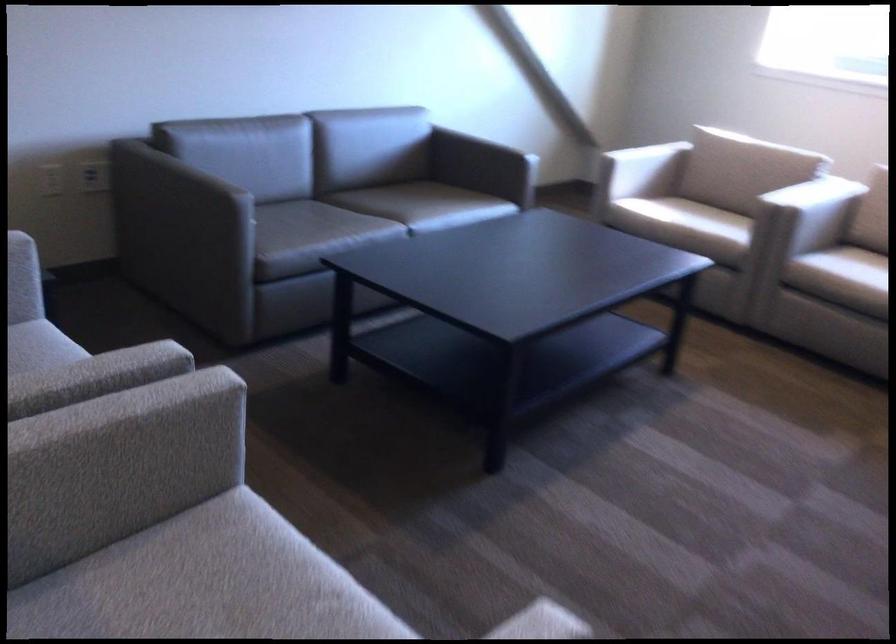
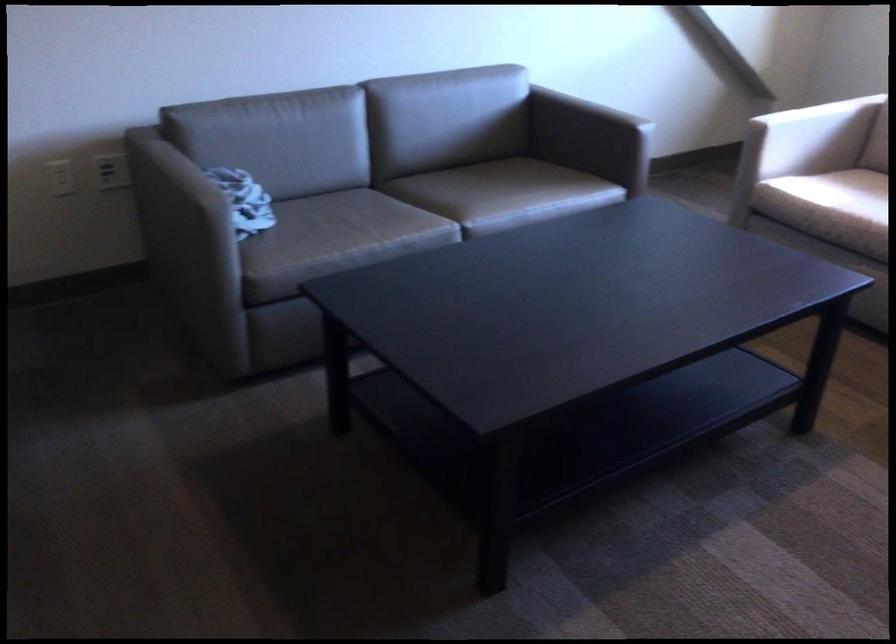
Locate, in the second image, the point that corresponds to pixel 653 169 in the first image.

(824, 137)